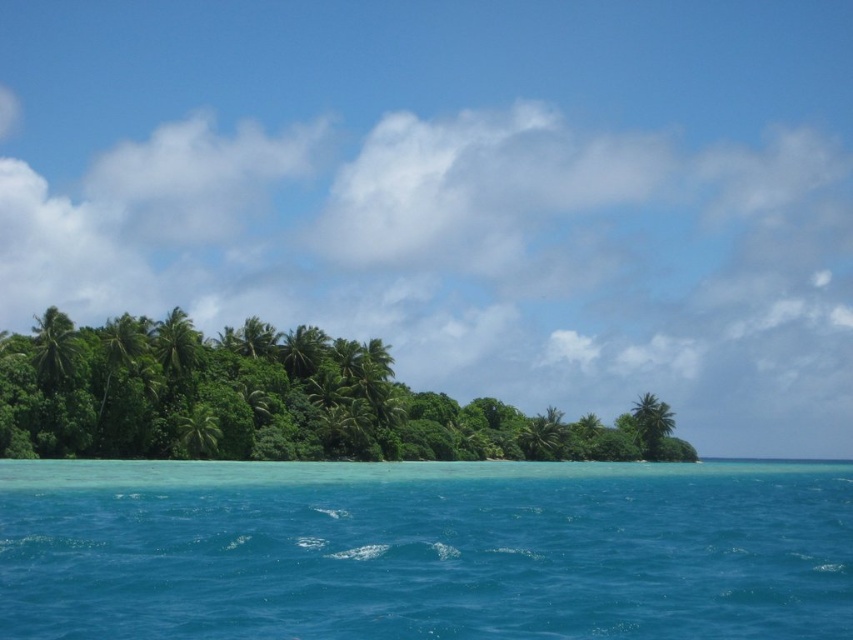
Is green leafy trees at center bigger than green leafy palm tree at left?

A: Yes, green leafy trees at center is bigger than green leafy palm tree at left.

Who is shorter, green leafy trees at center or green leafy palm tree at left?

green leafy palm tree at left

Where is `green leafy trees at center`? green leafy trees at center is located at coordinates (283, 403).

Which of these two, clear blue water at center or green leafy palm tree at center, stands shorter?

Standing shorter between the two is green leafy palm tree at center.

Does clear blue water at center have a smaller size compared to green leafy palm tree at center?

No.

What do you see at coordinates (422, 550) in the screenshot? I see `clear blue water at center` at bounding box center [422, 550].

At what (x,y) coordinates should I click in order to perform the action: click on clear blue water at center. Please return your answer as a coordinate pair (x, y). Image resolution: width=853 pixels, height=640 pixels. Looking at the image, I should click on (422, 550).

Measure the distance between green leafy trees at center and green leafy palm tree at center.

The distance of green leafy trees at center from green leafy palm tree at center is 36.40 meters.

Who is more distant from viewer, (366, 371) or (206, 449)?

The point (366, 371) is more distant.

This screenshot has height=640, width=853. Identify the location of green leafy trees at center. (283, 403).